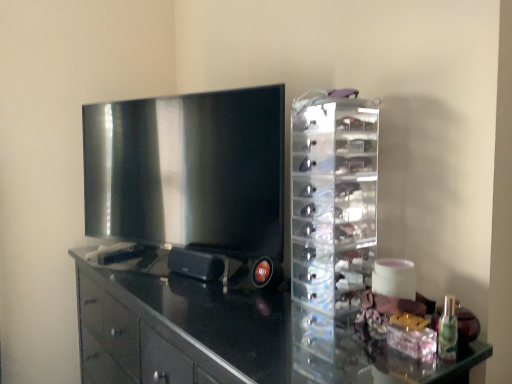
Question: From a real-world perspective, does matte black tv at left sit lower than glossy black cabinet at center?

Choices:
 (A) no
 (B) yes

Answer: (A)

Question: Are matte black tv at left and glossy black cabinet at center located far from each other?

Choices:
 (A) no
 (B) yes

Answer: (A)

Question: Is matte black tv at left facing away from glossy black cabinet at center?

Choices:
 (A) yes
 (B) no

Answer: (B)

Question: Can you confirm if matte black tv at left is positioned to the left of glossy black cabinet at center?

Choices:
 (A) yes
 (B) no

Answer: (A)

Question: Is matte black tv at left smaller than glossy black cabinet at center?

Choices:
 (A) yes
 (B) no

Answer: (A)

Question: From the image's perspective, is matte black tv at left over glossy black cabinet at center?

Choices:
 (A) yes
 (B) no

Answer: (A)

Question: Does glossy black cabinet at center have a lesser width compared to transparent acrylic organizer at right?

Choices:
 (A) yes
 (B) no

Answer: (B)

Question: Considering the relative sizes of glossy black cabinet at center and transparent acrylic organizer at right in the image provided, is glossy black cabinet at center wider than transparent acrylic organizer at right?

Choices:
 (A) no
 (B) yes

Answer: (B)

Question: Is glossy black cabinet at center closer to the viewer compared to transparent acrylic organizer at right?

Choices:
 (A) no
 (B) yes

Answer: (B)

Question: Is transparent acrylic organizer at right a part of glossy black cabinet at center?

Choices:
 (A) yes
 (B) no

Answer: (B)

Question: Does glossy black cabinet at center have a lesser height compared to transparent acrylic organizer at right?

Choices:
 (A) yes
 (B) no

Answer: (B)

Question: From a real-world perspective, is glossy black cabinet at center on top of transparent acrylic organizer at right?

Choices:
 (A) no
 (B) yes

Answer: (A)

Question: Is matte black tv at left to the right of transparent acrylic organizer at right from the viewer's perspective?

Choices:
 (A) no
 (B) yes

Answer: (A)